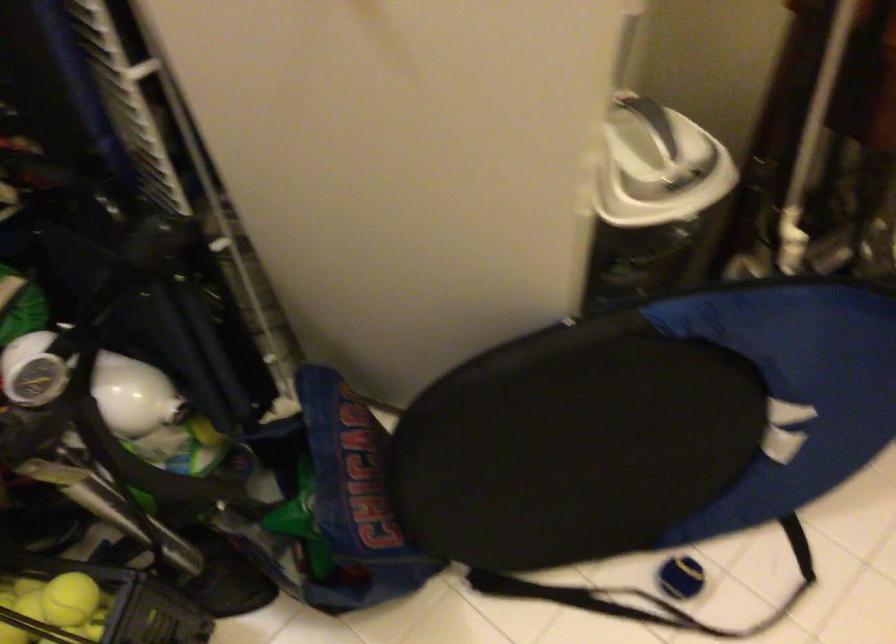
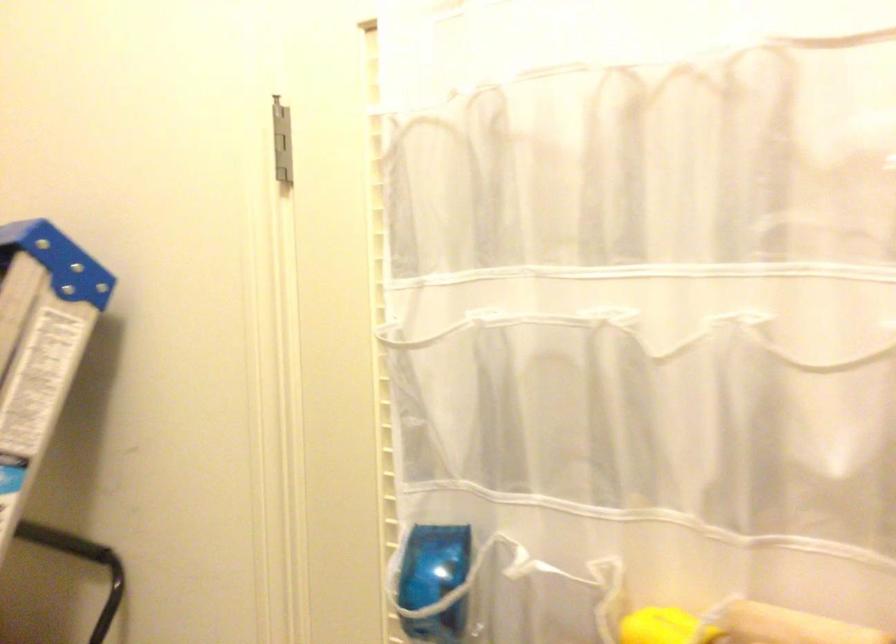
Question: The camera is either moving clockwise (left) or counter-clockwise (right) around the object. The first image is from the beginning of the video and the second image is from the end. Is the camera moving left or right when shooting the video?

Choices:
 (A) Left
 (B) Right

Answer: (A)